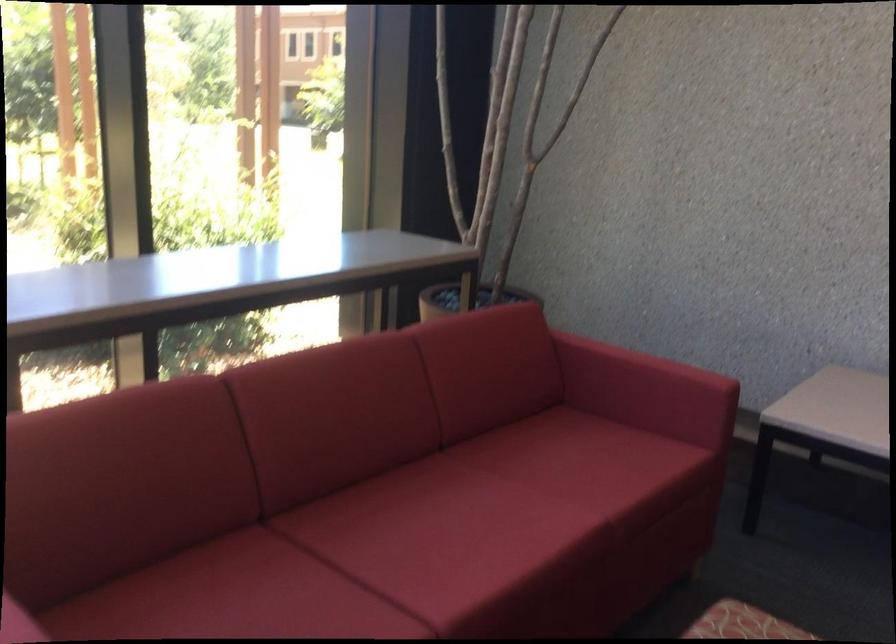
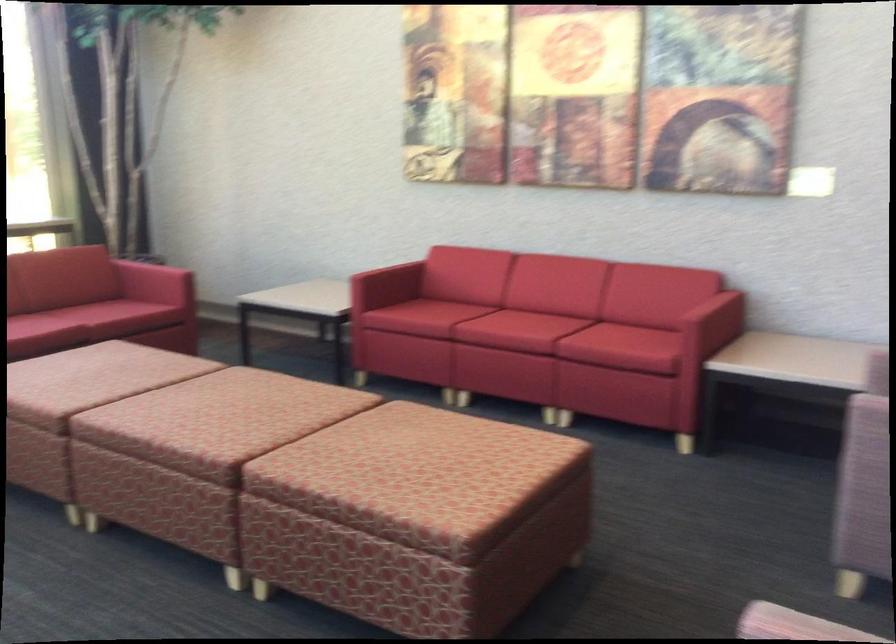
Based on the photo, what movement of the cameraman would produce the second image?

The cameraman moved toward right, backward.